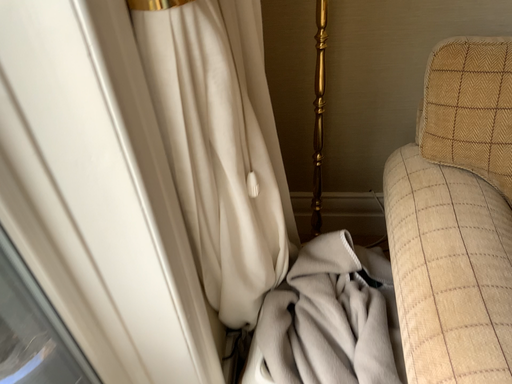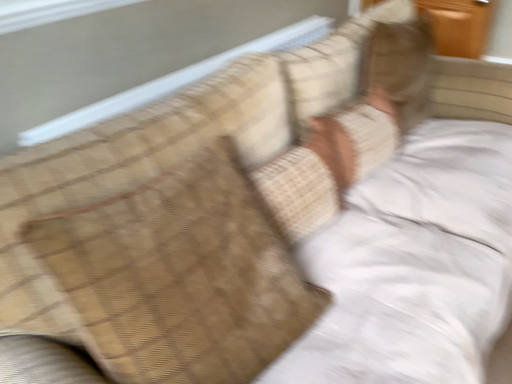
Question: Which way did the camera rotate in the video?

Choices:
 (A) rotated upward
 (B) rotated downward

Answer: (A)